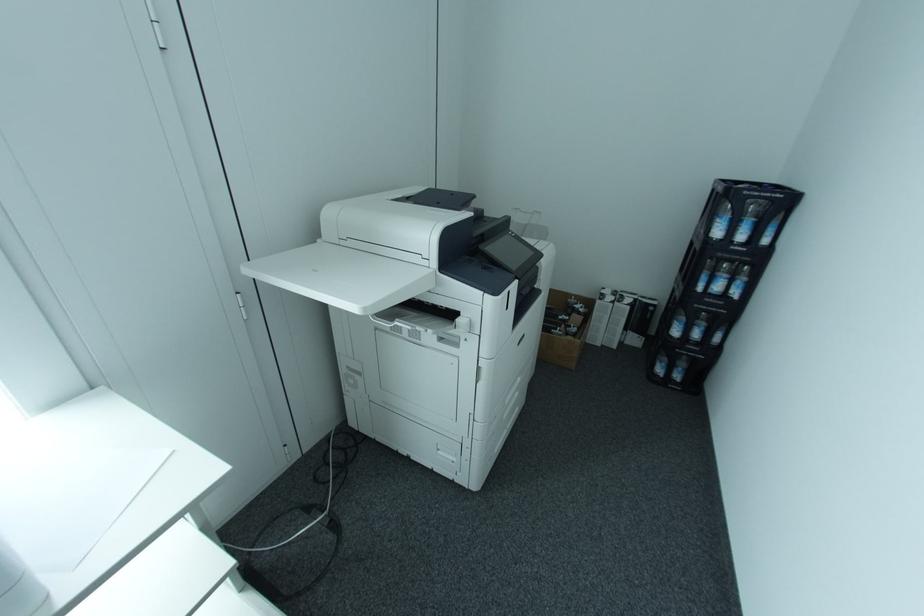
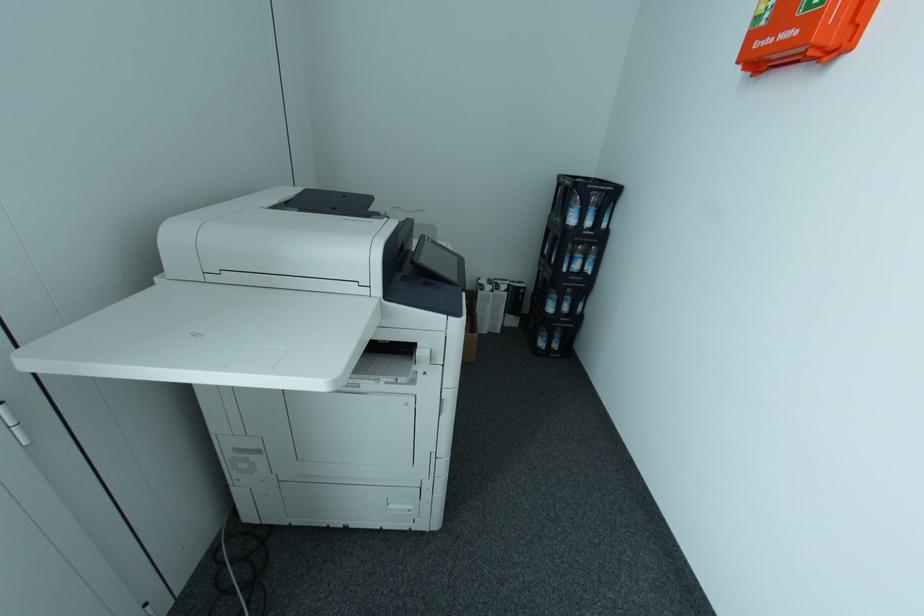
Question: How did the camera likely rotate?

Choices:
 (A) Left
 (B) Right
 (C) Up
 (D) Down

Answer: (B)